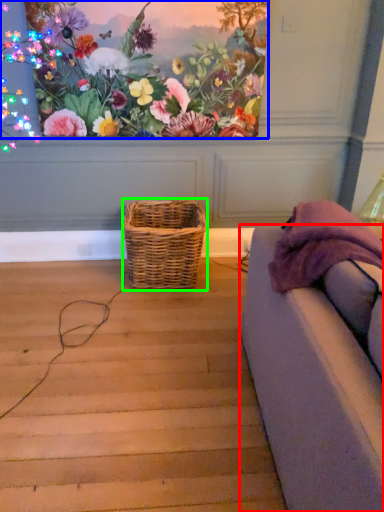
Question: Estimate the real-world distances between objects in this image. Which object is closer to studio couch (highlighted by a red box), flower (highlighted by a blue box) or picnic basket (highlighted by a green box)?

Choices:
 (A) flower
 (B) picnic basket

Answer: (B)